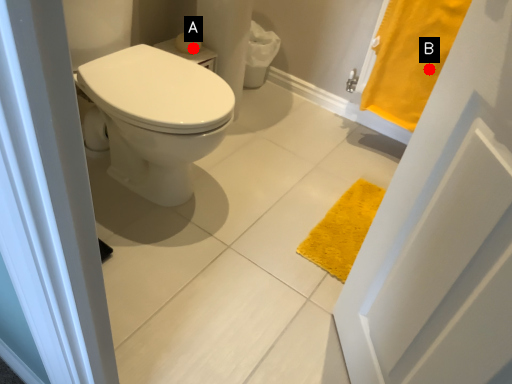
Question: Two points are circled on the image, labeled by A and B beside each circle. Which point is closer to the camera?

Choices:
 (A) A is closer
 (B) B is closer

Answer: (B)